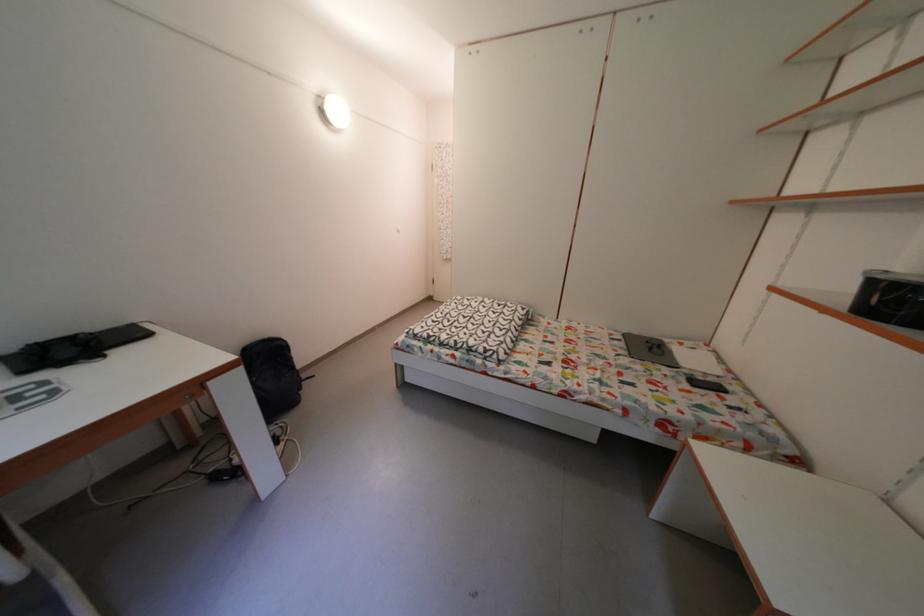
What do you see at coordinates (706, 384) in the screenshot? I see `the black phone` at bounding box center [706, 384].